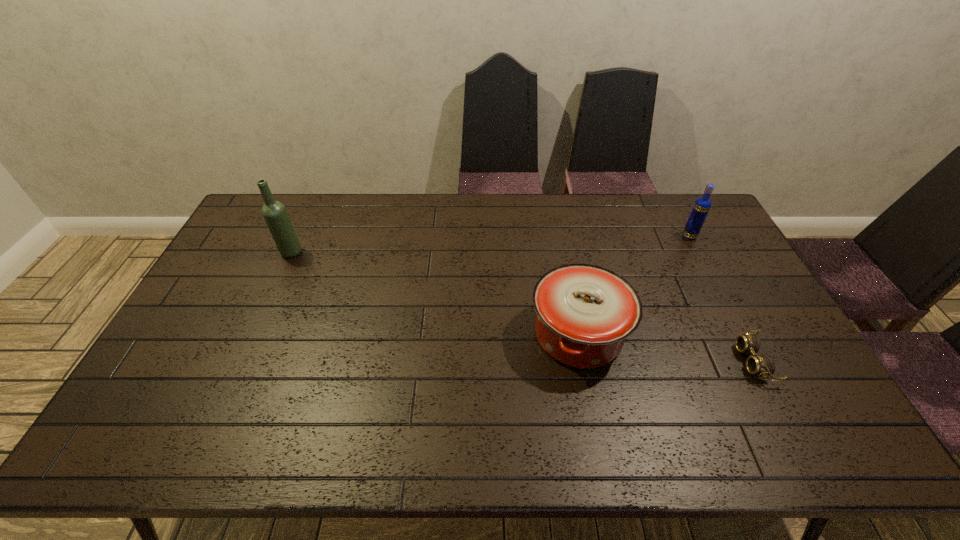
In the image, there is a desktop. Where is `vacant space at the far left corner`? vacant space at the far left corner is located at coordinates (257, 224).

Find the location of a particular element. Image resolution: width=960 pixels, height=540 pixels. free space at the far right corner of the desktop is located at coordinates (691, 204).

Where is `free space at the near right corner of the desktop`? Image resolution: width=960 pixels, height=540 pixels. free space at the near right corner of the desktop is located at coordinates (815, 434).

The image size is (960, 540). Find the location of `free space between the third nearest object and the farthest object`. free space between the third nearest object and the farthest object is located at coordinates (491, 244).

Locate an element on the screen. free space between the casserole and the shortest object is located at coordinates (666, 348).

Locate an element on the screen. The image size is (960, 540). free spot between the tallest object and the third tallest object is located at coordinates (435, 293).

The height and width of the screenshot is (540, 960). What are the coordinates of `free space between the goggles and the casserole` in the screenshot? It's located at (x=666, y=348).

Locate an element on the screen. Image resolution: width=960 pixels, height=540 pixels. free space between the vodka and the goggles is located at coordinates (721, 299).

The image size is (960, 540). Find the location of `empty space that is in between the tallest object and the farthest object`. empty space that is in between the tallest object and the farthest object is located at coordinates 491,244.

Where is `vacant area that lies between the goggles and the third object from right to left`? This screenshot has height=540, width=960. vacant area that lies between the goggles and the third object from right to left is located at coordinates (666, 348).